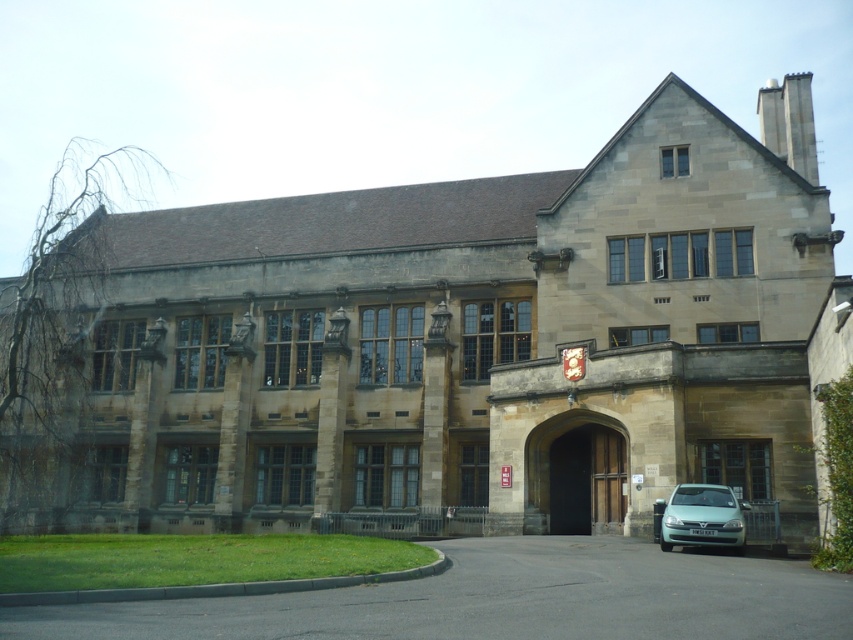
You are a delivery person with a cart that is 2 meters long. You need to move your cart from the black asphalt driveway at lower center to the brown wooden door at center. Can you fit your cart in the space between them?

The distance between the black asphalt driveway at lower center and the brown wooden door at center is 12.45 meters. Since your cart is only 2 meters long, there is more than enough space to move it between them.